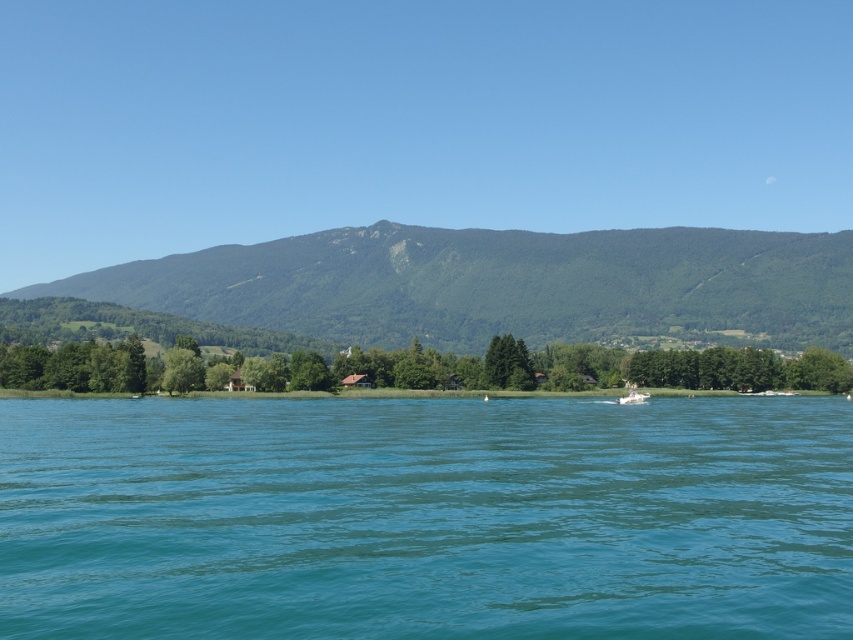
You are an architect designing a new observation deck that needs to have a view of both the teal smooth water at center and the green textured mountain at upper center. Given their spatial relationship, which object will occupy more of the view from the deck?

The green textured mountain at upper center occupies more space in the view from the deck than the teal smooth water at center because it is described as occupying less space.

You are a drone operator trying to capture the best aerial shot of the teal smooth water at center. According to the coordinates provided, where should you position the drone to ensure the water is centered in your shot?

To center the teal smooth water at center in your shot, position the drone at coordinates point [425,516] as the water is located there.

You are planning to take a photo of the white plastic boat at center and the green textured mountain at upper center. Which object will have a wider frame in your photo?

The green textured mountain at upper center has a greater width than the white plastic boat at center, so it will occupy a wider frame in the photo.